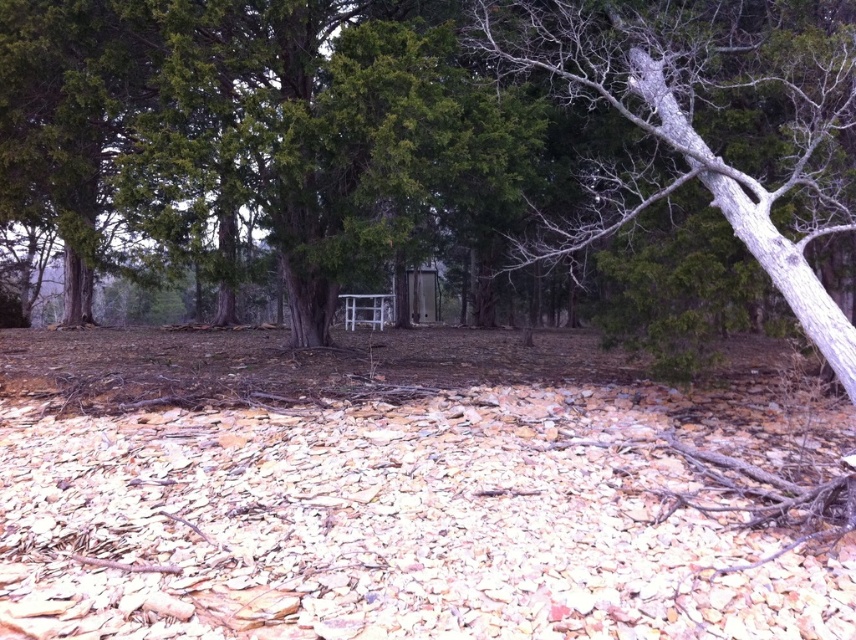
Can you confirm if brown dirt field at center is positioned below gray bark tree at center?

Indeed, brown dirt field at center is positioned under gray bark tree at center.

Does brown dirt field at center have a smaller size compared to gray bark tree at center?

No.

Does point (424, 592) come behind point (626, 24)?

No, (424, 592) is closer to viewer.

Identify the location of brown dirt field at center. (406, 490).

Does brown dirt field at center have a greater height compared to green rough bark tree at center?

In fact, brown dirt field at center may be shorter than green rough bark tree at center.

Can you confirm if brown dirt field at center is positioned to the left of green rough bark tree at center?

Yes, brown dirt field at center is to the left of green rough bark tree at center.

Which is behind, point (462, 422) or point (468, 104)?

Point (468, 104)

At what (x,y) coordinates should I click in order to perform the action: click on brown dirt field at center. Please return your answer as a coordinate pair (x, y). Looking at the image, I should click on (406, 490).

Describe the element at coordinates (431, 131) in the screenshot. The width and height of the screenshot is (856, 640). I see `green rough bark tree at center` at that location.

Is point (254, 38) less distant than point (634, 13)?

Yes, point (254, 38) is in front of point (634, 13).

Who is more forward, (789, 284) or (792, 60)?

Point (789, 284) is in front.

What are the coordinates of `green rough bark tree at center` in the screenshot? It's located at (431, 131).